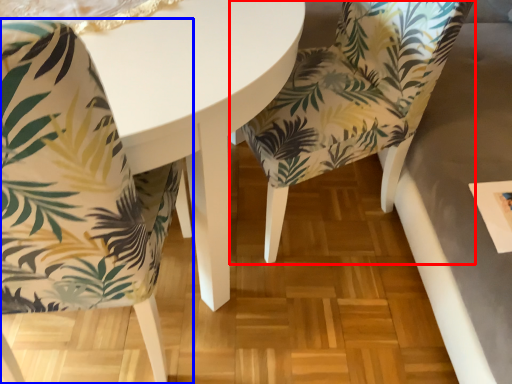
Question: Which object appears closest to the camera in this image, chair (highlighted by a red box) or chair (highlighted by a blue box)?

Choices:
 (A) chair
 (B) chair

Answer: (B)